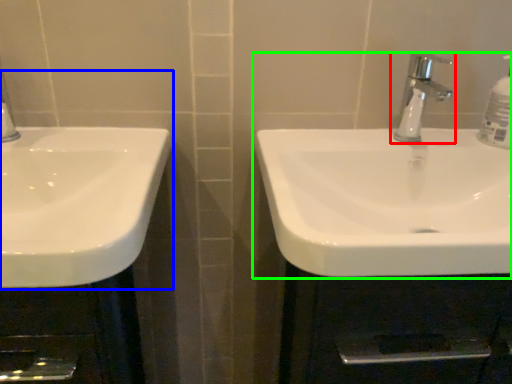
Question: Which object is the farthest from tap (highlighted by a red box)? Choose among these: sink (highlighted by a blue box) or sink (highlighted by a green box).

Choices:
 (A) sink
 (B) sink

Answer: (A)